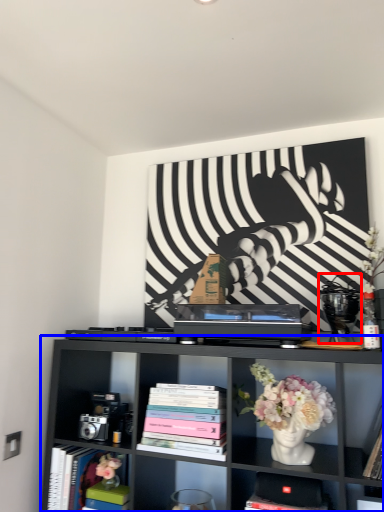
Question: Which of the following is the farthest to the observer, toy (highlighted by a red box) or shelf (highlighted by a blue box)?

Choices:
 (A) toy
 (B) shelf

Answer: (A)